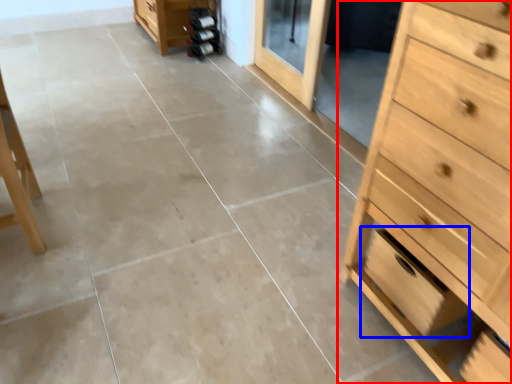
Question: Which object appears closest to the camera in this image, chest of drawers (highlighted by a red box) or drawer (highlighted by a blue box)?

Choices:
 (A) chest of drawers
 (B) drawer

Answer: (A)